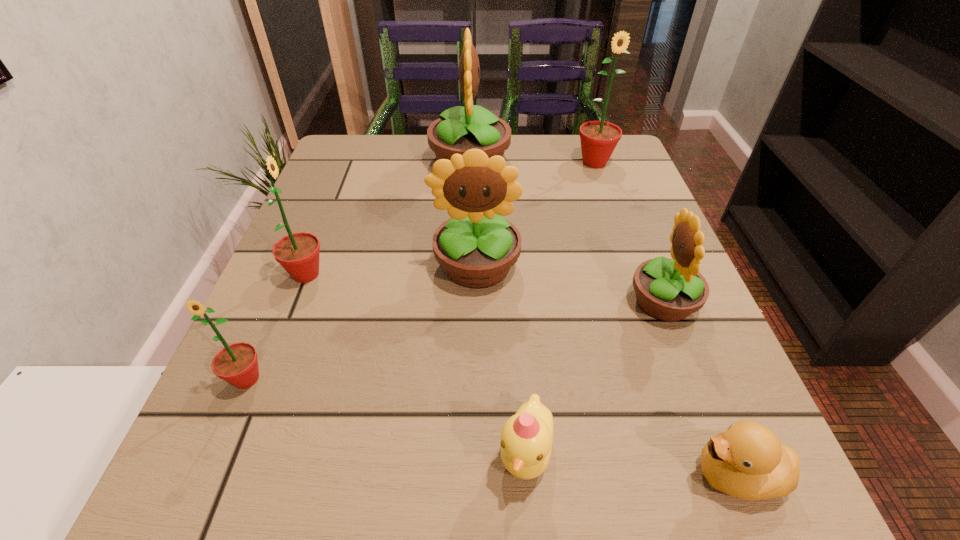
You are a GUI agent. You are given a task and a screenshot of the screen. Output one action in this format:
    pyautogui.click(x=<x>, y=<y>)
    Task: Click on the vacant space at the near right corner of the desktop
    This screenshot has width=960, height=540.
    Given the screenshot: What is the action you would take?
    pyautogui.click(x=669, y=462)

Identify the location of free area in between the rightmost yellow sunflower and the farthest green sunflower. (629, 232).

Locate an element on the screen. This screenshot has height=540, width=960. free space between the right duckling and the smallest green sunflower is located at coordinates (492, 427).

The image size is (960, 540). Identify the location of unoccupied area between the nearest sunflower and the second smallest yellow sunflower. coord(362,322).

Where is `free point between the left duckling and the biggest yellow sunflower`? This screenshot has width=960, height=540. free point between the left duckling and the biggest yellow sunflower is located at coordinates (497, 307).

The width and height of the screenshot is (960, 540). What are the coordinates of `free spot between the smallest yellow sunflower and the nearest green sunflower` in the screenshot? It's located at (455, 340).

You are a GUI agent. You are given a task and a screenshot of the screen. Output one action in this format:
    pyautogui.click(x=<x>, y=<y>)
    Task: Click on the free space between the nearest sunflower and the second biggest yellow sunflower
    Image resolution: width=960 pixels, height=540 pixels.
    Given the screenshot: What is the action you would take?
    pyautogui.click(x=362, y=322)

In order to click on vacant space that's between the nearest green sunflower and the farthest green sunflower in this screenshot , I will do `click(420, 271)`.

Identify the location of free point between the right duckling and the biggest yellow sunflower. (603, 319).

Point out which object is positioned as the fifth nearest to the second smallest yellow sunflower. Please provide its 2D coordinates. Your answer should be formatted as a tuple, i.e. [(x, y)], where the tuple contains the x and y coordinates of a point satisfying the conditions above.

[(237, 363)]